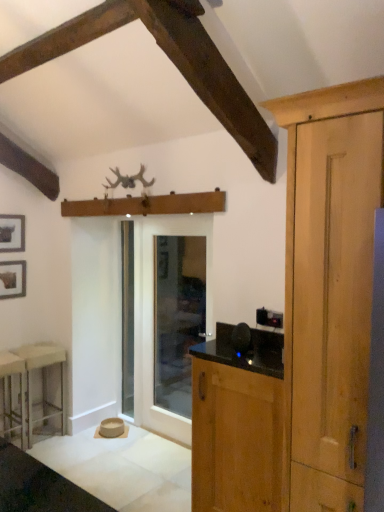
Question: From the image's perspective, would you say matte black picture frame at upper left, which appears as the second picture frame when ordered from the bottom, is positioned over metallic silver stool at lower left, which is the 2th stool from back to front?

Choices:
 (A) yes
 (B) no

Answer: (A)

Question: Is matte black picture frame at upper left, which appears as the first picture frame when viewed from the top, completely or partially outside of metallic silver stool at lower left, which ranks as the 1th stool in front-to-back order?

Choices:
 (A) no
 (B) yes

Answer: (B)

Question: Is matte black picture frame at upper left, which appears as the second picture frame when ordered from the bottom, closer to camera compared to metallic silver stool at lower left, which ranks as the 1th stool in front-to-back order?

Choices:
 (A) yes
 (B) no

Answer: (B)

Question: Can you confirm if matte black picture frame at upper left, which appears as the second picture frame when ordered from the bottom, is thinner than metallic silver stool at lower left, which is the 2th stool from back to front?

Choices:
 (A) no
 (B) yes

Answer: (B)

Question: Is matte black picture frame at upper left, which appears as the first picture frame when viewed from the top, further to the viewer compared to metallic silver stool at lower left, which is the 2th stool from back to front?

Choices:
 (A) no
 (B) yes

Answer: (B)

Question: Relative to clear glass screen door at center, which ranks as the second screen door in right-to-left order, is wooden cabinet at right in front or behind?

Choices:
 (A) behind
 (B) front

Answer: (B)

Question: Choose the correct answer: Is wooden cabinet at right inside clear glass screen door at center, which ranks as the second screen door in right-to-left order, or outside it?

Choices:
 (A) inside
 (B) outside

Answer: (B)

Question: Is point pos(241,368) closer or farther from the camera than point pos(132,354)?

Choices:
 (A) farther
 (B) closer

Answer: (B)

Question: Considering the positions of wooden cabinet at right and clear glass screen door at center, the 1th screen door from the left, in the image, is wooden cabinet at right taller or shorter than clear glass screen door at center, the 1th screen door from the left,?

Choices:
 (A) short
 (B) tall

Answer: (A)

Question: Is metallic silver stool at lower left, which ranks as the 1th stool in front-to-back order, in front of or behind wooden cabinet at right in the image?

Choices:
 (A) behind
 (B) front

Answer: (A)

Question: From the image's perspective, is metallic silver stool at lower left, which ranks as the 1th stool in front-to-back order, located above or below wooden cabinet at right?

Choices:
 (A) below
 (B) above

Answer: (A)

Question: Considering the positions of metallic silver stool at lower left, which ranks as the 1th stool in front-to-back order, and wooden cabinet at right in the image, is metallic silver stool at lower left, which ranks as the 1th stool in front-to-back order, wider or thinner than wooden cabinet at right?

Choices:
 (A) wide
 (B) thin

Answer: (A)

Question: Is metallic silver stool at lower left, which ranks as the 1th stool in front-to-back order, taller or shorter than wooden cabinet at right?

Choices:
 (A) short
 (B) tall

Answer: (A)

Question: Considering the positions of wooden cabinet at right and matte black picture frame at upper left, which appears as the first picture frame when viewed from the top, in the image, is wooden cabinet at right wider or thinner than matte black picture frame at upper left, which appears as the first picture frame when viewed from the top,?

Choices:
 (A) thin
 (B) wide

Answer: (B)

Question: From the image's perspective, is wooden cabinet at right located above or below matte black picture frame at upper left, which appears as the second picture frame when ordered from the bottom?

Choices:
 (A) above
 (B) below

Answer: (B)